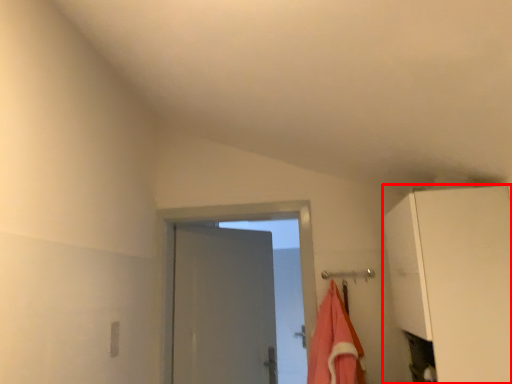
Question: From the image's perspective, where is cabinetry (annotated by the red box) located in relation to beach towel in the image?

Choices:
 (A) above
 (B) below

Answer: (A)